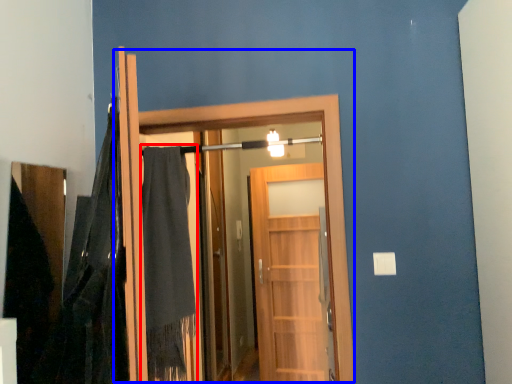
Question: Among these objects, which one is nearest to the camera, robe (highlighted by a red box) or door (highlighted by a blue box)?

Choices:
 (A) robe
 (B) door

Answer: (B)